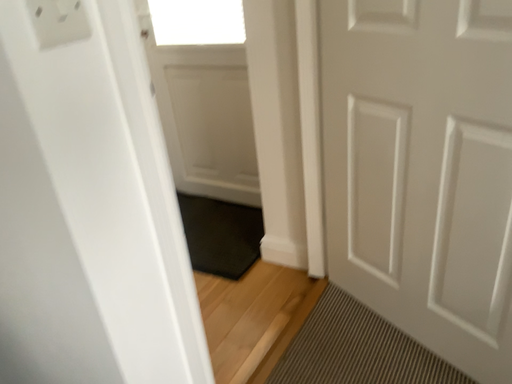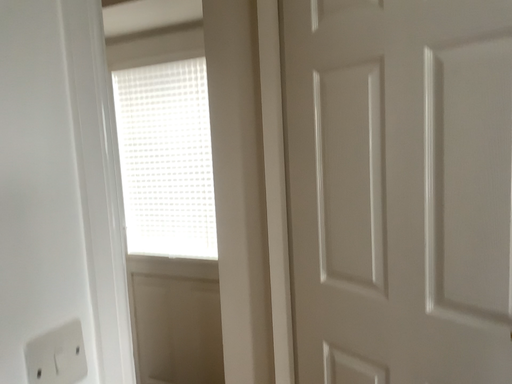
Question: Which way did the camera rotate in the video?

Choices:
 (A) rotated upward
 (B) rotated downward

Answer: (A)